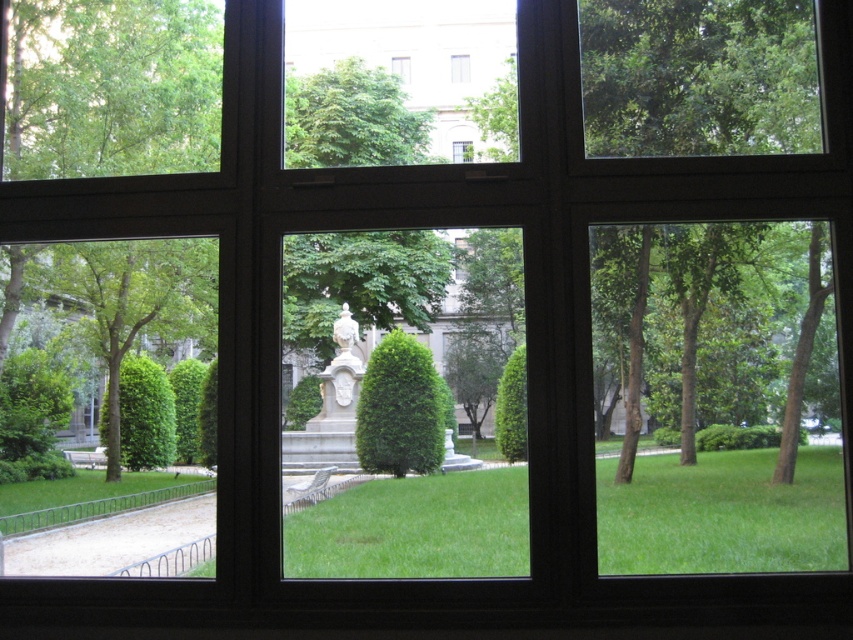
Which is behind, point (434, 433) or point (392, 68)?

The point (392, 68) is more distant.

Is green leafy tree at center smaller than transparent glass window at upper center?

No, green leafy tree at center is not smaller than transparent glass window at upper center.

This screenshot has height=640, width=853. Identify the location of green leafy tree at center. (399, 410).

Is green leafy tree at lower left below green leafy tree at center?

Actually, green leafy tree at lower left is above green leafy tree at center.

Who is positioned more to the right, green leafy tree at lower left or green leafy tree at center?

green leafy tree at center

Between point (131, 20) and point (427, 449), which one is positioned in front?

Positioned in front is point (131, 20).

I want to click on green leafy tree at lower left, so click(112, 88).

Who is higher up, white marble statue at center or transparent glass window at center?

transparent glass window at center

In order to click on white marble statue at center in this screenshot , I will do `click(339, 380)`.